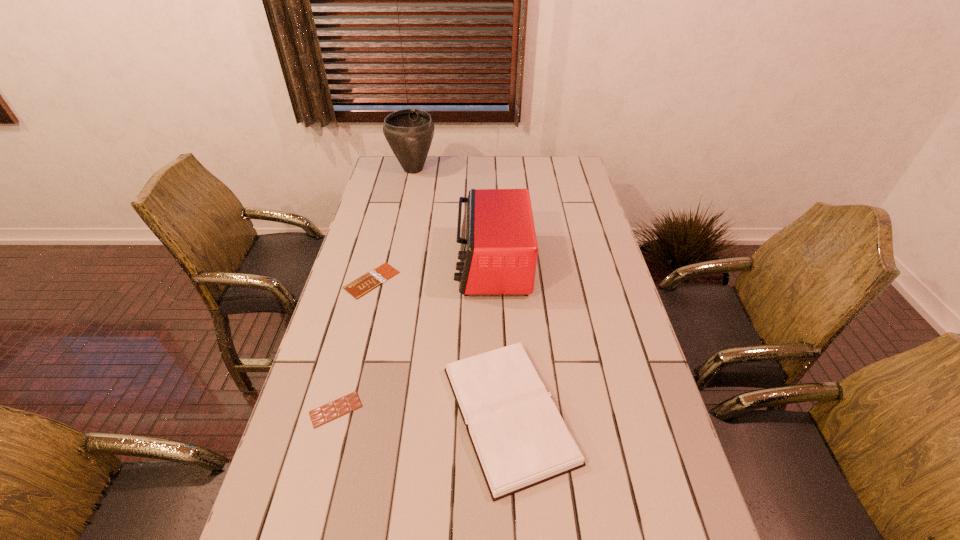
At what (x,y) coordinates should I click in order to perform the action: click on free spot located 0.110m on the front-facing side of the second tallest object. Please return your answer as a coordinate pair (x, y). Looking at the image, I should click on (423, 265).

I want to click on free space located 0.180m on the front-facing side of the second tallest object, so (402, 265).

The image size is (960, 540). Identify the location of free space located 0.170m on the left of the hardback book. (372, 414).

At what (x,y) coordinates should I click in order to perform the action: click on vacant space situated on the right of the taller chocolate bar. Please return your answer as a coordinate pair (x, y). Looking at the image, I should click on (467, 409).

Locate an element on the screen. free space located 0.090m on the front of the shorter chocolate bar is located at coordinates (361, 322).

At what (x,y) coordinates should I click in order to perform the action: click on object located in the far edge section of the desktop. Please return your answer as a coordinate pair (x, y). This screenshot has width=960, height=540. Looking at the image, I should click on (409, 132).

Where is `urn located in the left edge section of the desktop`? Image resolution: width=960 pixels, height=540 pixels. urn located in the left edge section of the desktop is located at coordinates (409, 132).

Where is `object present at the far left corner`? This screenshot has height=540, width=960. object present at the far left corner is located at coordinates (409, 132).

In the image, there is a desktop. In order to click on vacant space at the far edge in this screenshot , I will do `click(530, 162)`.

This screenshot has height=540, width=960. Identify the location of blank space at the left edge of the desktop. (380, 232).